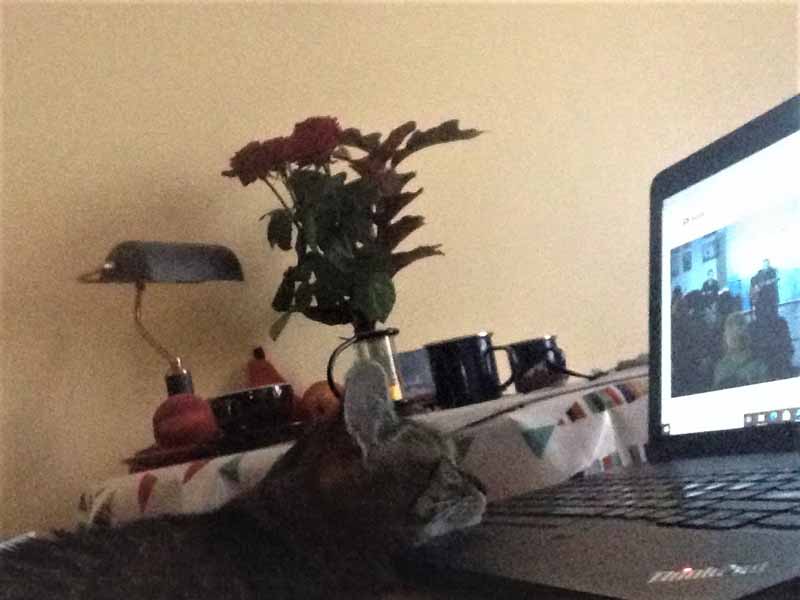
I want to click on table, so point(518,422).